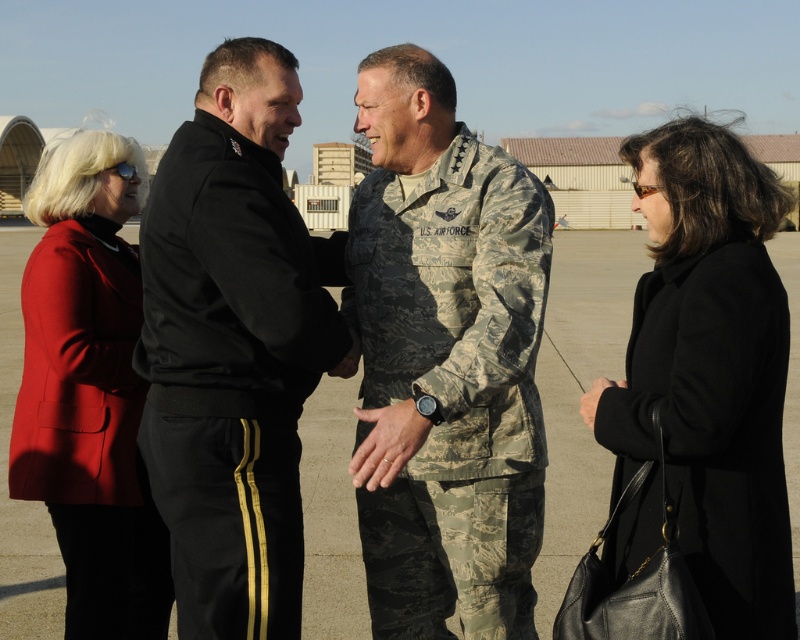
You are a photographer at the airfield and want to capture a photo where both the black leather coat at lower right and the matte red blazer at left are visible. Given their heights, which one might you need to adjust your camera angle to ensure it doesn

The black leather coat at lower right is shorter than the matte red blazer at left. To ensure both are visible, you might need to lower your camera angle slightly to capture the shorter black leather coat at lower right while still including the taller matte red blazer at left in the frame.

You are standing at the center of the airfield and need to locate the black leather coat at lower right. According to the coordinates provided, in which direction should you move to find it?

The black leather coat at lower right is located at point coordinates, so you should move towards the lower right direction from your current position at the center of the airfield.